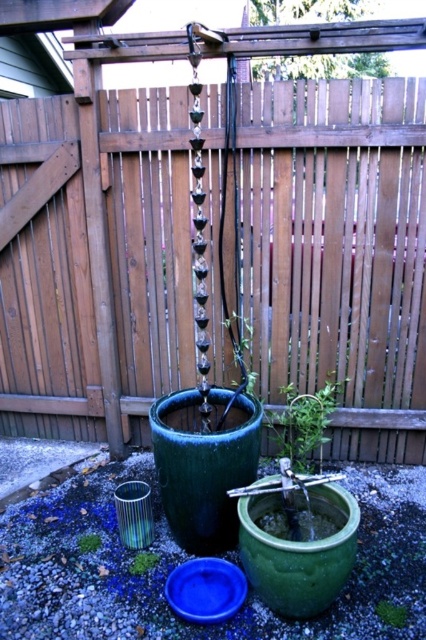
Question: Is green matte plant at center to the left of green matte plant at lower center from the viewer's perspective?

Choices:
 (A) yes
 (B) no

Answer: (B)

Question: Which point is closer to the camera taking this photo?

Choices:
 (A) (190, 257)
 (B) (129, 568)
 (C) (391, 604)
 (D) (305, 403)

Answer: (C)

Question: Which point is farther to the camera?

Choices:
 (A) green leafy plant at lower center
 (B) green matte plant at lower center
 (C) green matte plant at center
 (D) wooden fence at center

Answer: (C)

Question: Is wooden fence at center positioned behind green leafy plant at lower center?

Choices:
 (A) yes
 (B) no

Answer: (A)

Question: Considering the real-world distances, which object is closest to the green glossy plant at lower center?

Choices:
 (A) wooden fence at center
 (B) green matte plant at lower center
 (C) green matte plant at center

Answer: (B)

Question: Is green matte plant at center wider than green matte plant at lower center?

Choices:
 (A) no
 (B) yes

Answer: (B)